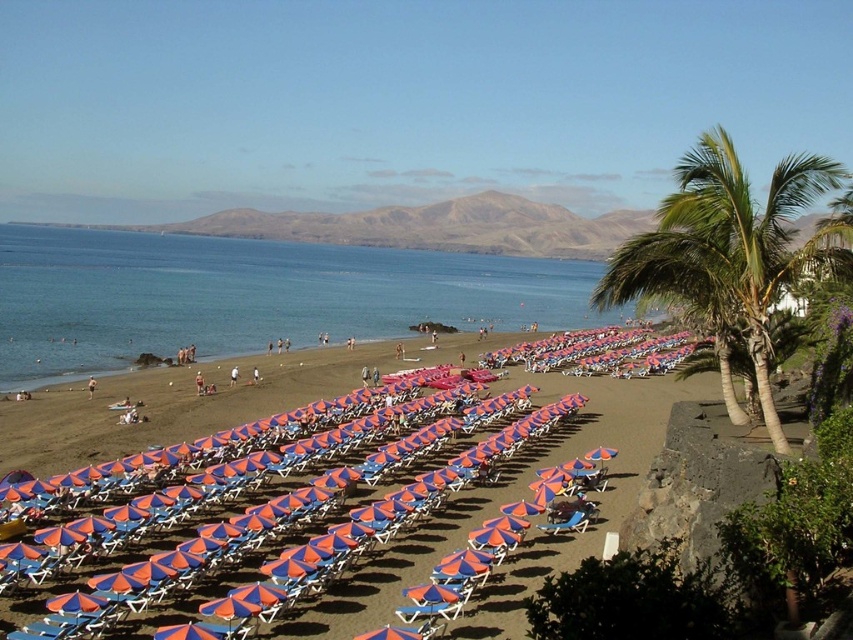
You are standing at the center of the beach looking towards the sea. Which direction should you walk to reach the green leafy palm tree at right?

The green leafy palm tree at right is located at the right side of the beach, so you should walk towards the right direction from your current position at the center to reach it.

You are standing on the beach and want to take a photo of the green leafy palm tree at right and the blue water at left. If you want the palm tree to appear in front of the blue water in your photo, should you move closer to or farther away from the palm tree?

The green leafy palm tree at right is behind the blue water at left, so to have the palm tree appear in front of the blue water in your photo, you should move closer to the green leafy palm tree at right.